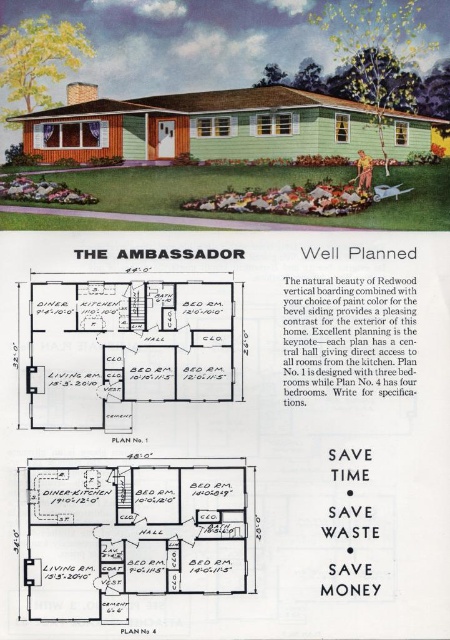
Question: Which of the following is the closest to the observer?

Choices:
 (A) (62, 346)
 (B) (46, 520)

Answer: (B)

Question: Does matte green wall at lower center have a smaller size compared to white wood floor at center?

Choices:
 (A) yes
 (B) no

Answer: (B)

Question: Is matte green wall at lower center bigger than white wood floor at center?

Choices:
 (A) yes
 (B) no

Answer: (A)

Question: Can you confirm if matte green wall at lower center is positioned below white wood floor at center?

Choices:
 (A) yes
 (B) no

Answer: (A)

Question: Which object is closer to the camera taking this photo?

Choices:
 (A) matte green wall at lower center
 (B) white wood floor at center

Answer: (A)